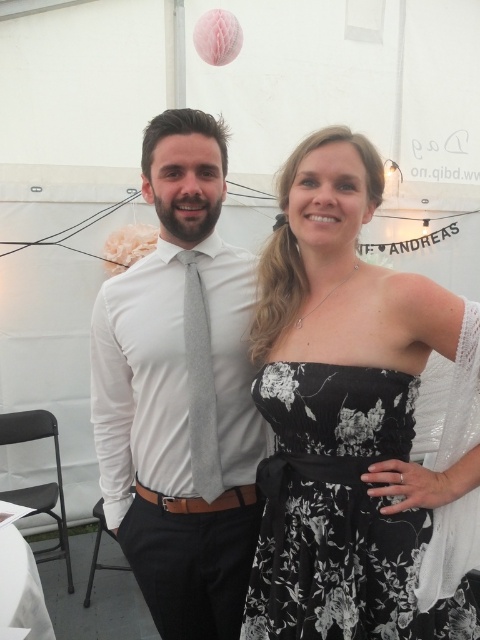
Question: Does white satin dress at center have a lesser width compared to gray textured tie at center?

Choices:
 (A) no
 (B) yes

Answer: (A)

Question: Is white satin dress at center in front of matte gray tie at center?

Choices:
 (A) no
 (B) yes

Answer: (B)

Question: Which of the following is the closest to the observer?

Choices:
 (A) (364, 461)
 (B) (208, 218)
 (C) (316, 627)
 (D) (200, 496)

Answer: (C)

Question: Which point appears closest to the camera in this image?

Choices:
 (A) (253, 504)
 (B) (192, 392)
 (C) (256, 614)

Answer: (C)

Question: Does white satin dress at center come in front of black floral dress at center?

Choices:
 (A) no
 (B) yes

Answer: (B)

Question: Which point is farther from the camera taking this photo?

Choices:
 (A) (x=194, y=451)
 (B) (x=229, y=332)

Answer: (B)